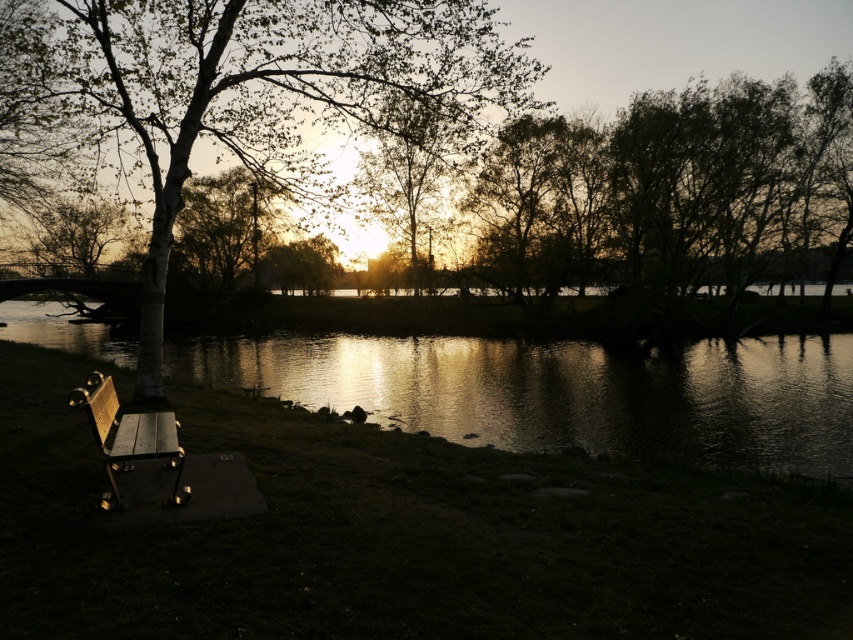
Which is above, silvery metallic tree at center or wooden bench at lower left?

silvery metallic tree at center

Does point (456, 104) come closer to viewer compared to point (120, 504)?

That is False.

This screenshot has width=853, height=640. What do you see at coordinates (409, 161) in the screenshot?
I see `silvery metallic tree at center` at bounding box center [409, 161].

Where is `silvery metallic tree at center`? The image size is (853, 640). silvery metallic tree at center is located at coordinates (409, 161).

Is glistening water at center above smooth white tree at center?

Actually, glistening water at center is below smooth white tree at center.

How distant is glistening water at center from smooth white tree at center?

glistening water at center and smooth white tree at center are 11.92 meters apart from each other.

Which is in front, point (583, 352) or point (325, 104)?

Positioned in front is point (583, 352).

Locate an element on the screen. This screenshot has width=853, height=640. glistening water at center is located at coordinates (564, 392).

Who is taller, glistening water at center or wooden bench at lower left?

glistening water at center

Is point (186, 356) farther from viewer compared to point (113, 499)?

Yes, point (186, 356) is behind point (113, 499).

Who is more distant from viewer, (94, 333) or (134, 456)?

Positioned behind is point (94, 333).

The image size is (853, 640). I want to click on glistening water at center, so click(x=564, y=392).